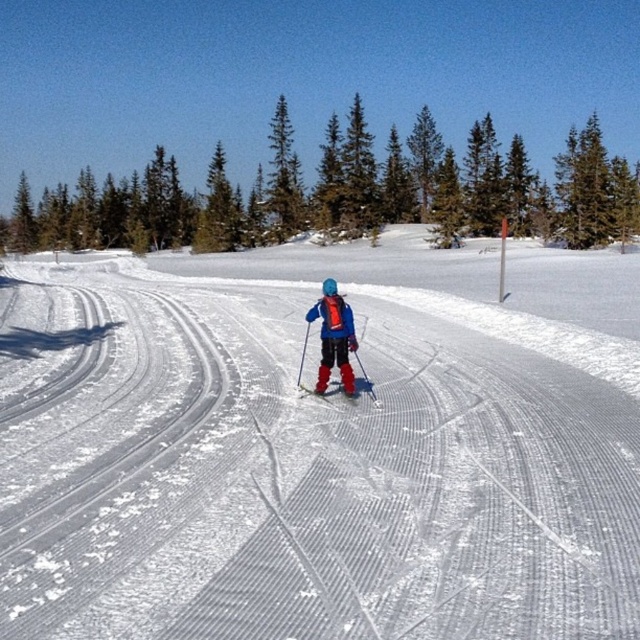
You are a photographer planning to take a closeup shot of both the matte blue ski suit at center and the matte red ski at center. Your camera has a maximum focus range of 10 inches. Can you capture both objects in focus without moving the camera?

The distance between the matte blue ski suit at center and the matte red ski at center is 9.92 inches, which is within the camera maximum focus range of 10 inches. Therefore, you can capture both objects in focus without moving the camera.

You are a skier planning to take a shortcut through the white textured snow at center and the green coniferous trees at upper center. Which path has a narrower width?

The white textured snow at center is thinner than green coniferous trees at upper center, so the white textured snow at center has a narrower width.